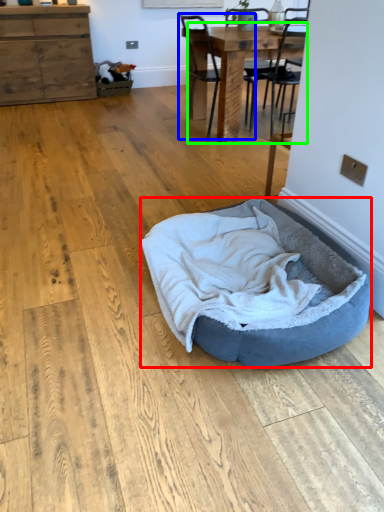
Question: Which object is positioned closest to dog bed (highlighted by a red box)? Select from chair (highlighted by a blue box) and table (highlighted by a green box).

Choices:
 (A) chair
 (B) table

Answer: (B)